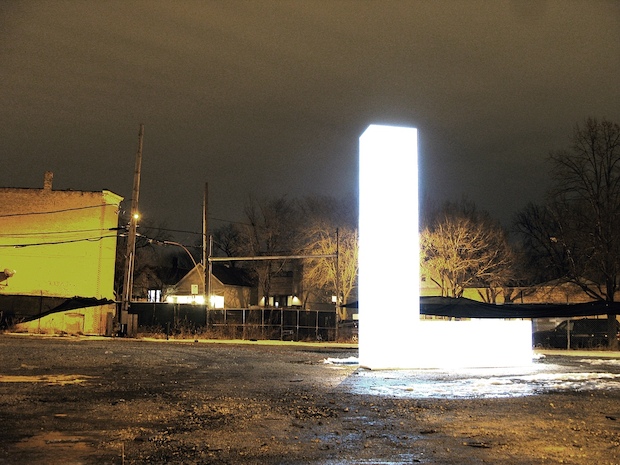
You are a GUI agent. You are given a task and a screenshot of the screen. Output one action in this format:
    pyautogui.click(x=<x>, y=<y>)
    Task: Click on the light fixture
    
    Given the screenshot: What is the action you would take?
    pyautogui.click(x=383, y=257)